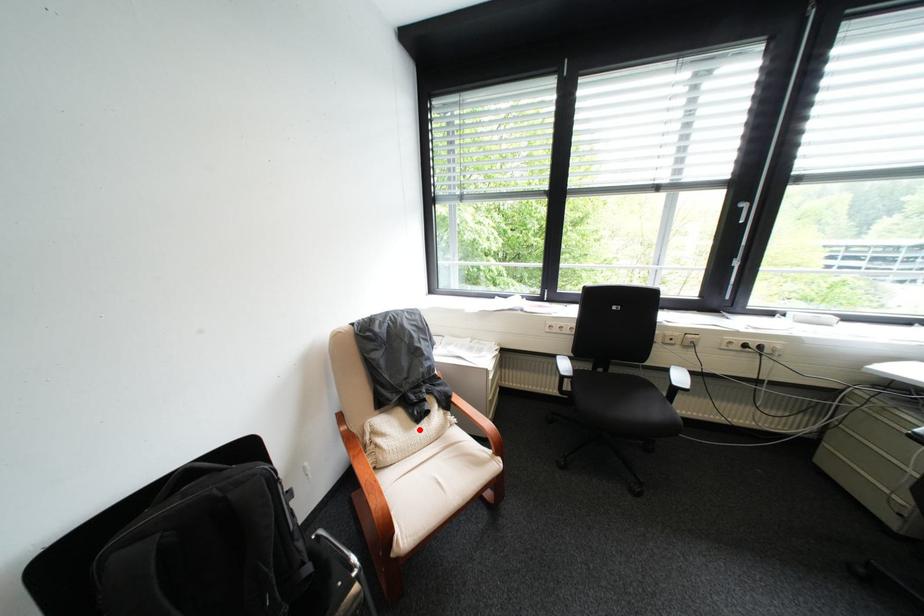
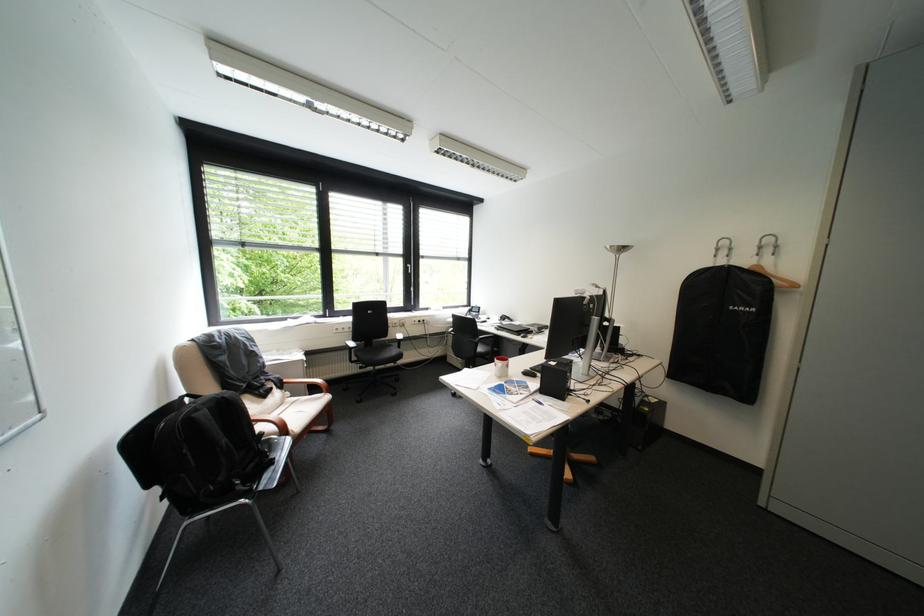
In the second image, find the point that corresponds to the highlighted location in the first image.

(272, 403)